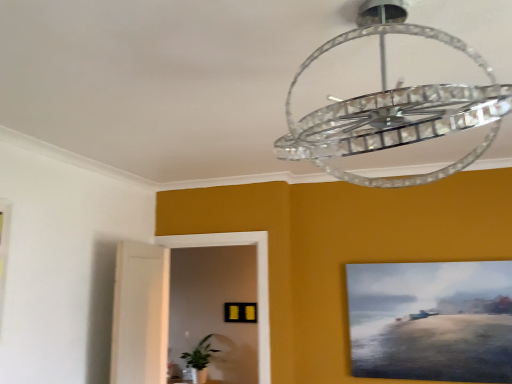
Question: Does green leafy plant at lower left lie behind clear crystal chandelier at upper center?

Choices:
 (A) yes
 (B) no

Answer: (A)

Question: Is green leafy plant at lower left closer to the viewer compared to clear crystal chandelier at upper center?

Choices:
 (A) yes
 (B) no

Answer: (B)

Question: Is green leafy plant at lower left to the left of clear crystal chandelier at upper center from the viewer's perspective?

Choices:
 (A) yes
 (B) no

Answer: (A)

Question: Is green leafy plant at lower left positioned far away from clear crystal chandelier at upper center?

Choices:
 (A) yes
 (B) no

Answer: (A)

Question: From a real-world perspective, is green leafy plant at lower left positioned under clear crystal chandelier at upper center based on gravity?

Choices:
 (A) yes
 (B) no

Answer: (A)

Question: Does green leafy plant at lower left turn towards clear crystal chandelier at upper center?

Choices:
 (A) yes
 (B) no

Answer: (B)

Question: Can you confirm if matte yellow picture frame at center, the 1th picture frame positioned from the left, is thinner than clear crystal chandelier at upper center?

Choices:
 (A) no
 (B) yes

Answer: (B)

Question: Are matte yellow picture frame at center, acting as the 2th picture frame starting from the front, and clear crystal chandelier at upper center making contact?

Choices:
 (A) no
 (B) yes

Answer: (A)

Question: Considering the relative sizes of matte yellow picture frame at center, which appears as the second picture frame when viewed from the right, and clear crystal chandelier at upper center in the image provided, is matte yellow picture frame at center, which appears as the second picture frame when viewed from the right, wider than clear crystal chandelier at upper center?

Choices:
 (A) yes
 (B) no

Answer: (B)

Question: Is matte yellow picture frame at center, which is counted as the second picture frame, starting from the top, at the left side of clear crystal chandelier at upper center?

Choices:
 (A) no
 (B) yes

Answer: (B)

Question: Is matte yellow picture frame at center, which appears as the second picture frame when viewed from the right, located outside clear crystal chandelier at upper center?

Choices:
 (A) yes
 (B) no

Answer: (A)

Question: Is matte yellow picture frame at center, which ranks as the 1th picture frame in back-to-front order, far away from clear crystal chandelier at upper center?

Choices:
 (A) no
 (B) yes

Answer: (B)

Question: Is clear crystal chandelier at upper center positioned before green leafy plant at lower left?

Choices:
 (A) no
 (B) yes

Answer: (B)